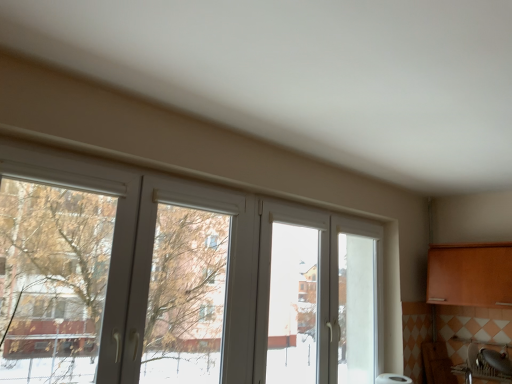
Find the location of a particular element. The image size is (512, 384). matte silver sink at lower right is located at coordinates (485, 363).

What do you see at coordinates (485, 363) in the screenshot?
I see `matte silver sink at lower right` at bounding box center [485, 363].

In order to face matte silver sink at lower right, should I rotate leftwards or rightwards?

You should rotate right by 28.434 degrees.

Where is `white plastic window at center`? white plastic window at center is located at coordinates (184, 280).

This screenshot has width=512, height=384. Describe the element at coordinates (184, 280) in the screenshot. I see `white plastic window at center` at that location.

Find the location of `matte silver sink at lower right`. matte silver sink at lower right is located at coordinates (485, 363).

Would you say white plastic window at center is to the left or to the right of matte silver sink at lower right in the picture?

From the image, it's evident that white plastic window at center is to the left of matte silver sink at lower right.

Between white plastic window at center and matte silver sink at lower right, which one is positioned behind?

matte silver sink at lower right is further away from the camera.

Which point is more distant from viewer, (88, 161) or (469, 342)?

The point (469, 342) is farther.

From the image's perspective, between white plastic window at center and matte silver sink at lower right, which one is located above?

white plastic window at center appears higher in the image.

From a real-world perspective, is white plastic window at center on top of matte silver sink at lower right?

Yes, from a real-world perspective, white plastic window at center is on top of matte silver sink at lower right.

Can you confirm if white plastic window at center is wider than matte silver sink at lower right?

Incorrect, the width of white plastic window at center does not surpass that of matte silver sink at lower right.

Can you confirm if white plastic window at center is shorter than matte silver sink at lower right?

Incorrect, the height of white plastic window at center does not fall short of that of matte silver sink at lower right.

Based on their sizes in the image, would you say white plastic window at center is bigger or smaller than matte silver sink at lower right?

Considering their sizes, white plastic window at center takes up more space than matte silver sink at lower right.

Can we say white plastic window at center lies outside matte silver sink at lower right?

Yes, white plastic window at center is outside of matte silver sink at lower right.

Is white plastic window at center placed right next to matte silver sink at lower right?

No, white plastic window at center is not in contact with matte silver sink at lower right.

Is white plastic window at center oriented towards matte silver sink at lower right?

No, white plastic window at center is not oriented towards matte silver sink at lower right.

How many degrees apart are the facing directions of white plastic window at center and matte silver sink at lower right?

89.7 degrees separate the facing orientations of white plastic window at center and matte silver sink at lower right.

Where is `window lying above the matte silver sink at lower right (from the image's perspective)`? The height and width of the screenshot is (384, 512). window lying above the matte silver sink at lower right (from the image's perspective) is located at coordinates (184, 280).

Between matte silver sink at lower right and white plastic window at center, which one appears on the left side from the viewer's perspective?

white plastic window at center is more to the left.

Considering the positions of objects matte silver sink at lower right and white plastic window at center in the image provided, who is behind, matte silver sink at lower right or white plastic window at center?

matte silver sink at lower right is further away from the camera.

Which point is more forward, (493, 354) or (8, 244)?

Point (8, 244)

From the image's perspective, is matte silver sink at lower right located beneath white plastic window at center?

Indeed, from the image's perspective, matte silver sink at lower right is shown beneath white plastic window at center.

From a real-world perspective, is matte silver sink at lower right located beneath white plastic window at center?

Yes, from a real-world perspective, matte silver sink at lower right is beneath white plastic window at center.

Is matte silver sink at lower right wider or thinner than white plastic window at center?

Considering their sizes, matte silver sink at lower right looks broader than white plastic window at center.

Considering the sizes of objects matte silver sink at lower right and white plastic window at center in the image provided, who is shorter, matte silver sink at lower right or white plastic window at center?

With less height is matte silver sink at lower right.

Which of these two, matte silver sink at lower right or white plastic window at center, is bigger?

Bigger between the two is white plastic window at center.

Is matte silver sink at lower right spatially inside white plastic window at center, or outside of it?

matte silver sink at lower right is not enclosed by white plastic window at center.

Consider the image. Are matte silver sink at lower right and white plastic window at center located far from each other?

Yes, matte silver sink at lower right is far from white plastic window at center.

Is matte silver sink at lower right oriented towards white plastic window at center?

Yes, matte silver sink at lower right is oriented towards white plastic window at center.

Measure the distance from matte silver sink at lower right to white plastic window at center.

The distance of matte silver sink at lower right from white plastic window at center is 6.63 feet.

You are a GUI agent. You are given a task and a screenshot of the screen. Output one action in this format:
    pyautogui.click(x=<x>, y=<y>)
    Task: Click on the window above the matte silver sink at lower right (from a real-world perspective)
    This screenshot has width=512, height=384.
    Given the screenshot: What is the action you would take?
    pyautogui.click(x=184, y=280)

Where is `sink that appears on the right of white plastic window at center`? This screenshot has width=512, height=384. sink that appears on the right of white plastic window at center is located at coordinates (485, 363).

Where is `sink behind the white plastic window at center`? Image resolution: width=512 pixels, height=384 pixels. sink behind the white plastic window at center is located at coordinates (485, 363).